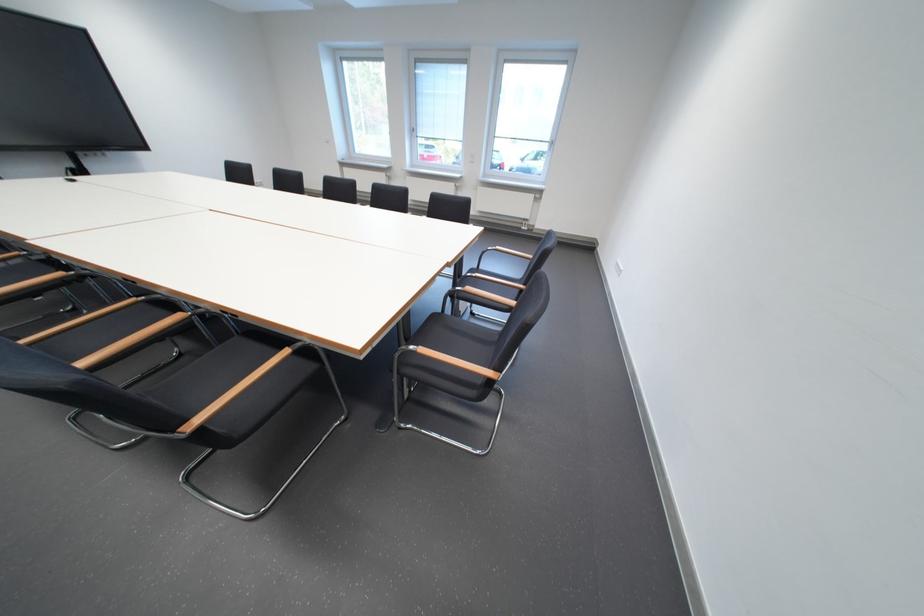
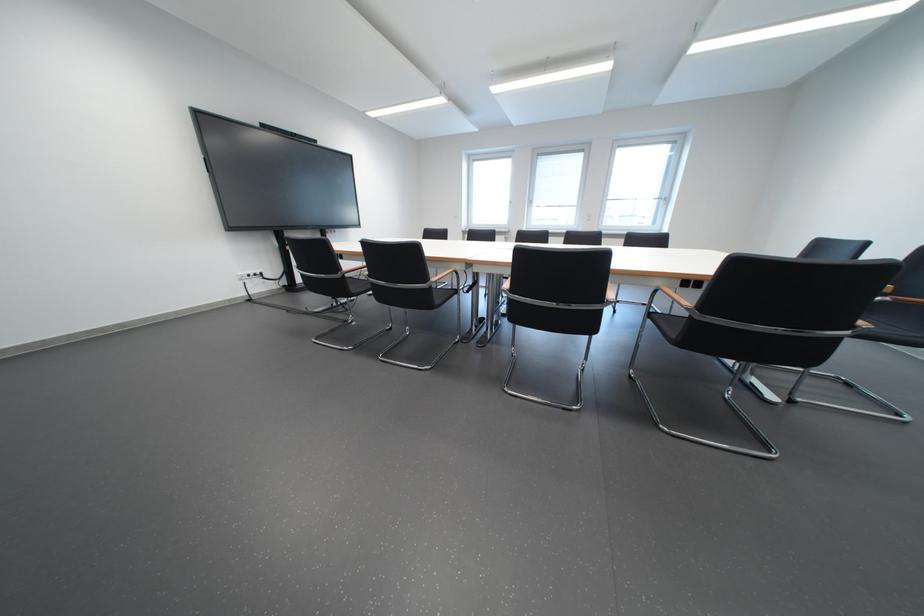
Question: The images are taken continuously from a first-person perspective. In which direction are you moving?

Choices:
 (A) Left
 (B) Right
 (C) Forward
 (D) Backward

Answer: (A)